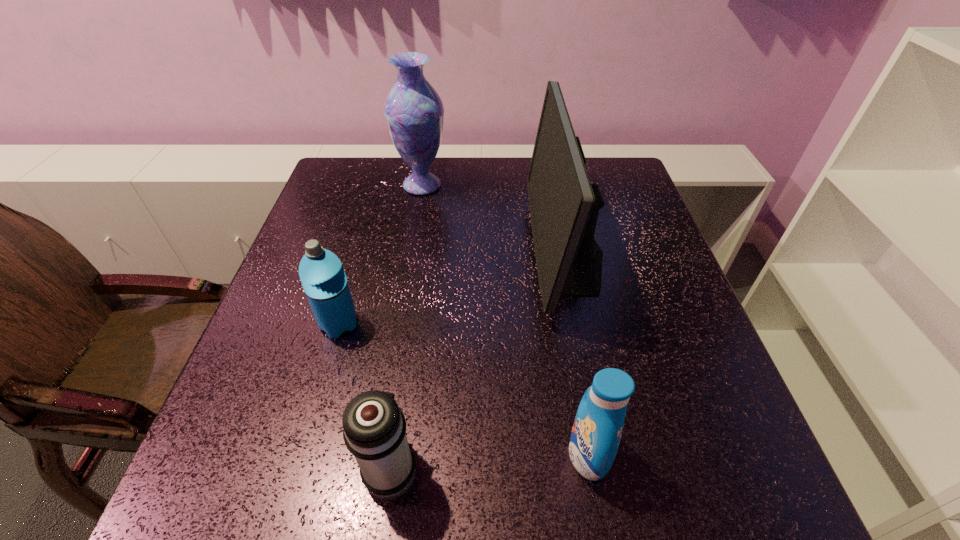
In order to click on vacant space located 0.280m on the front of the farther thermos bottle in this screenshot , I will do `click(293, 485)`.

Locate an element on the screen. vacant space located on the front-facing side of the detergent is located at coordinates (379, 454).

The image size is (960, 540). What are the coordinates of `vacant space located on the front-facing side of the detergent` in the screenshot? It's located at (422, 454).

The width and height of the screenshot is (960, 540). What are the coordinates of `vacant point located 0.280m on the front-facing side of the detergent` in the screenshot? It's located at (397, 454).

Locate an element on the screen. free space located 0.330m on the side with the handle of the right thermos bottle is located at coordinates (x=416, y=294).

Where is `free space located on the side with the handle of the right thermos bottle`? The height and width of the screenshot is (540, 960). free space located on the side with the handle of the right thermos bottle is located at coordinates (412, 319).

Identify the location of vacant space positioned on the side with the handle of the right thermos bottle. (406, 359).

The width and height of the screenshot is (960, 540). Find the location of `vase located at the far edge`. vase located at the far edge is located at coordinates (414, 112).

Where is `computer monitor at the far edge`? The height and width of the screenshot is (540, 960). computer monitor at the far edge is located at coordinates (564, 205).

Locate an element on the screen. The height and width of the screenshot is (540, 960). detergent that is at the near edge is located at coordinates (597, 429).